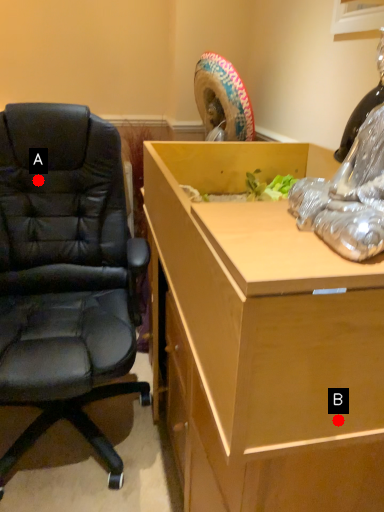
Question: Two points are circled on the image, labeled by A and B beside each circle. Among these points, which one is farthest from the camera?

Choices:
 (A) A is further
 (B) B is further

Answer: (A)